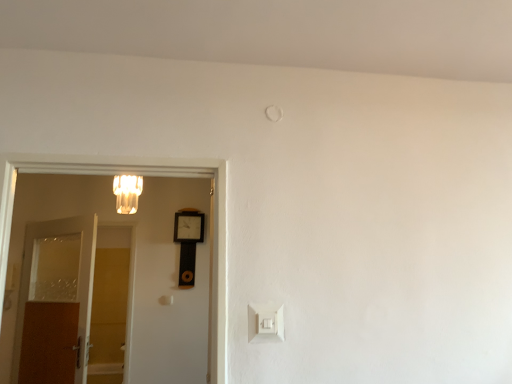
Question: Is white plastic light switch at lower center inside white wooden door at left, the 1th door from the right?

Choices:
 (A) yes
 (B) no

Answer: (B)

Question: From the image's perspective, is white wooden door at left, marked as the first door in a front-to-back arrangement, located above white plastic light switch at lower center?

Choices:
 (A) no
 (B) yes

Answer: (B)

Question: From the image's perspective, is white wooden door at left, the 1th door from the right, below white plastic light switch at lower center?

Choices:
 (A) no
 (B) yes

Answer: (A)

Question: Is there a large distance between white wooden door at left, the 1th door from the right, and white plastic light switch at lower center?

Choices:
 (A) yes
 (B) no

Answer: (B)

Question: Considering the relative sizes of white wooden door at left, positioned as the second door in left-to-right order, and white plastic light switch at lower center in the image provided, is white wooden door at left, positioned as the second door in left-to-right order, shorter than white plastic light switch at lower center?

Choices:
 (A) yes
 (B) no

Answer: (B)

Question: Is white wooden door at left, positioned as the second door in left-to-right order, oriented away from white plastic light switch at lower center?

Choices:
 (A) no
 (B) yes

Answer: (A)

Question: Does brown wooden door at left, acting as the first door starting from the back, appear on the right side of white plastic light switch at lower center?

Choices:
 (A) yes
 (B) no

Answer: (B)

Question: Can you confirm if brown wooden door at left, which appears as the first door when viewed from the left, is taller than white plastic light switch at lower center?

Choices:
 (A) no
 (B) yes

Answer: (B)

Question: Could white plastic light switch at lower center be considered to be inside brown wooden door at left, acting as the 2th door starting from the right?

Choices:
 (A) yes
 (B) no

Answer: (B)

Question: Is brown wooden door at left, which appears as the first door when viewed from the left, smaller than white plastic light switch at lower center?

Choices:
 (A) yes
 (B) no

Answer: (B)

Question: From the image's perspective, is brown wooden door at left, acting as the first door starting from the back, on top of white plastic light switch at lower center?

Choices:
 (A) yes
 (B) no

Answer: (B)

Question: From a real-world perspective, is brown wooden door at left, which appears as the first door when viewed from the left, beneath white plastic light switch at lower center?

Choices:
 (A) yes
 (B) no

Answer: (B)

Question: From a real-world perspective, is brown wooden door at left, acting as the first door starting from the back, positioned over matte glass chandelier at upper left based on gravity?

Choices:
 (A) no
 (B) yes

Answer: (A)